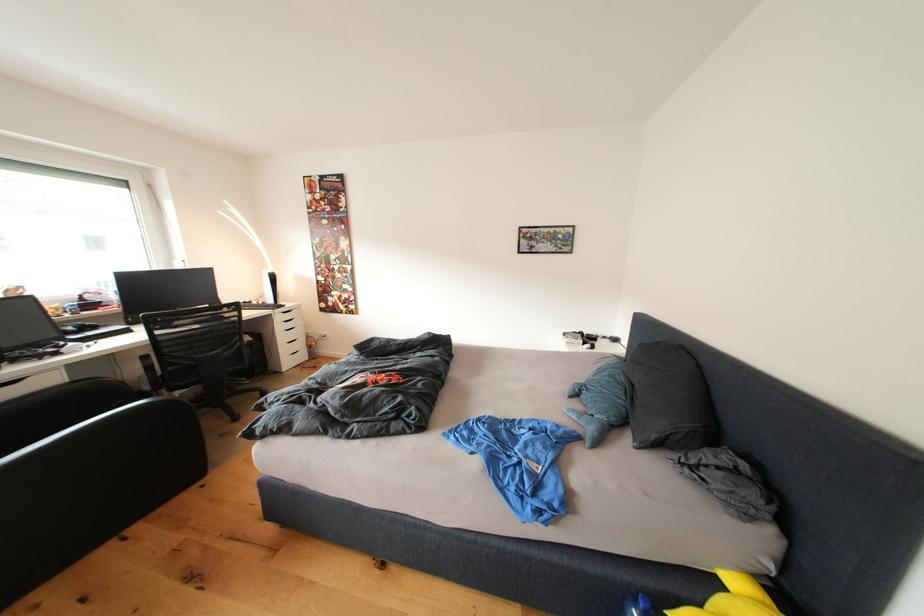
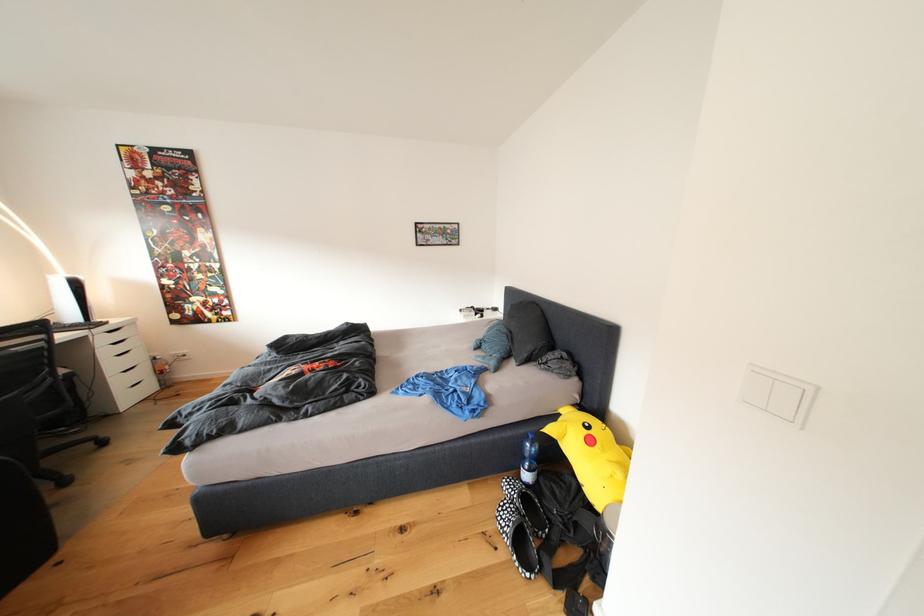
Question: Based on the continuous images, in which direction is the camera rotating? Reply with the corresponding letter.

Choices:
 (A) Left
 (B) Right
 (C) Up
 (D) Down

Answer: (B)